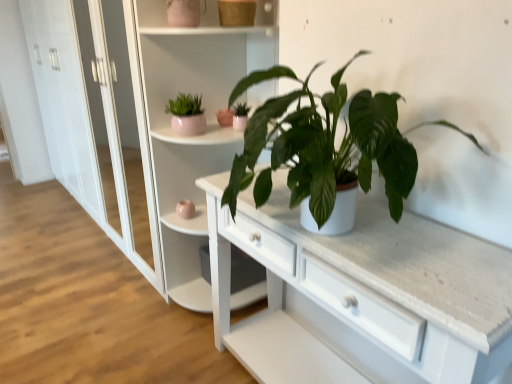
Question: Is matte white pot at center, arranged as the second houseplant when viewed from the right, smaller than green matte plant at center, the 1th houseplant positioned from the front?

Choices:
 (A) no
 (B) yes

Answer: (B)

Question: Is matte white pot at center, the third houseplant positioned from the front, wider than green matte plant at center, marked as the first houseplant in a right-to-left arrangement?

Choices:
 (A) yes
 (B) no

Answer: (B)

Question: Considering the relative positions of matte white pot at center, marked as the second houseplant in a left-to-right arrangement, and green matte plant at center, which ranks as the third houseplant in back-to-front order, in the image provided, is matte white pot at center, marked as the second houseplant in a left-to-right arrangement, to the left of green matte plant at center, which ranks as the third houseplant in back-to-front order, from the viewer's perspective?

Choices:
 (A) no
 (B) yes

Answer: (B)

Question: From a real-world perspective, is matte white pot at center, the 1th houseplant when ordered from back to front, physically above green matte plant at center, marked as the first houseplant in a right-to-left arrangement?

Choices:
 (A) no
 (B) yes

Answer: (A)

Question: Would you say green matte plant at center, the 1th houseplant positioned from the front, is part of matte white pot at center, the 1th houseplant when ordered from back to front,'s contents?

Choices:
 (A) no
 (B) yes

Answer: (A)

Question: Based on their positions, is matte white pot at center, the 1th houseplant when ordered from back to front, located to the left or right of matte pink pot at upper left, which ranks as the 2th houseplant in front-to-back order?

Choices:
 (A) left
 (B) right

Answer: (B)

Question: Looking at their shapes, would you say matte white pot at center, arranged as the second houseplant when viewed from the right, is wider or thinner than matte pink pot at upper left, the 2th houseplant positioned from the back?

Choices:
 (A) thin
 (B) wide

Answer: (A)

Question: Do you think matte white pot at center, the 1th houseplant when ordered from back to front, is within matte pink pot at upper left, the 2th houseplant positioned from the back, or outside of it?

Choices:
 (A) inside
 (B) outside

Answer: (B)

Question: In terms of height, does matte white pot at center, marked as the second houseplant in a left-to-right arrangement, look taller or shorter compared to matte pink pot at upper left, which ranks as the 2th houseplant in front-to-back order?

Choices:
 (A) tall
 (B) short

Answer: (B)

Question: From the image's perspective, relative to green matte plant at center, which ranks as the third houseplant in back-to-front order, is matte white pot at center, the third houseplant positioned from the front, above or below?

Choices:
 (A) above
 (B) below

Answer: (A)

Question: Based on their sizes in the image, would you say matte white pot at center, marked as the second houseplant in a left-to-right arrangement, is bigger or smaller than green matte plant at center, the 1th houseplant positioned from the front?

Choices:
 (A) small
 (B) big

Answer: (A)

Question: In terms of width, does matte white pot at center, marked as the second houseplant in a left-to-right arrangement, look wider or thinner when compared to green matte plant at center, which ranks as the third houseplant in back-to-front order?

Choices:
 (A) wide
 (B) thin

Answer: (B)

Question: From a real-world perspective, relative to green matte plant at center, marked as the first houseplant in a right-to-left arrangement, is matte white pot at center, the third houseplant positioned from the front, vertically above or below?

Choices:
 (A) below
 (B) above

Answer: (A)

Question: Considering the positions of white glossy bookshelf at upper center and matte white pot at center, the third houseplant positioned from the front, in the image, is white glossy bookshelf at upper center bigger or smaller than matte white pot at center, the third houseplant positioned from the front,?

Choices:
 (A) big
 (B) small

Answer: (A)

Question: Would you say white glossy bookshelf at upper center is inside or outside matte white pot at center, marked as the second houseplant in a left-to-right arrangement?

Choices:
 (A) outside
 (B) inside

Answer: (A)